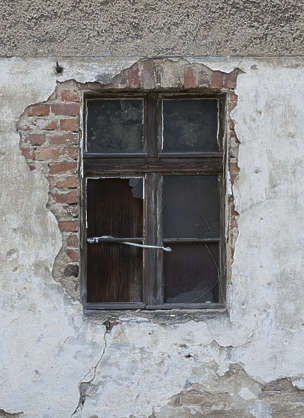
You are a GUI agent. You are given a task and a screenshot of the screen. Output one action in this format:
    pyautogui.click(x=<x>, y=<y>)
    Task: Click on the top windows
    The height and width of the screenshot is (418, 304).
    Given the screenshot: What is the action you would take?
    pyautogui.click(x=121, y=123), pyautogui.click(x=192, y=117)